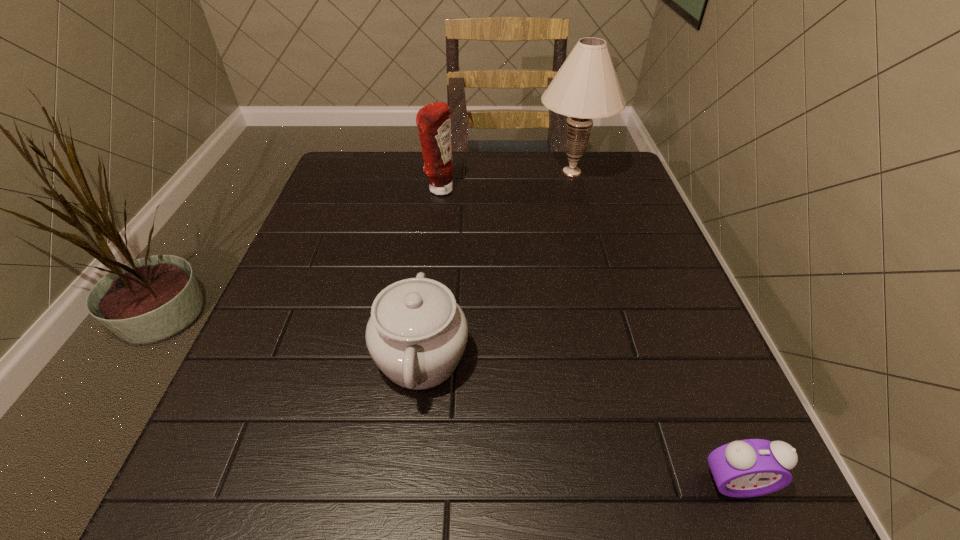
Locate an element on the screen. free point between the lampshade and the third farthest object is located at coordinates (496, 265).

Locate which object ranks second in proximity to the second tallest object. Please provide its 2D coordinates. Your answer should be formatted as a tuple, i.e. [(x, y)], where the tuple contains the x and y coordinates of a point satisfying the conditions above.

[(417, 333)]

Find the location of a particular element. object that stands as the second closest to the second shortest object is located at coordinates (433, 120).

At what (x,y) coordinates should I click in order to perform the action: click on free spot that satisfies the following two spatial constraints: 1. on the front side of the third shortest object; 2. on the right side of the third farthest object. Please return your answer as a coordinate pair (x, y). This screenshot has height=540, width=960. Looking at the image, I should click on (419, 357).

Find the location of a particular element. Image resolution: width=960 pixels, height=540 pixels. vacant space that satisfies the following two spatial constraints: 1. on the front side of the second tallest object; 2. on the right side of the third tallest object is located at coordinates (419, 357).